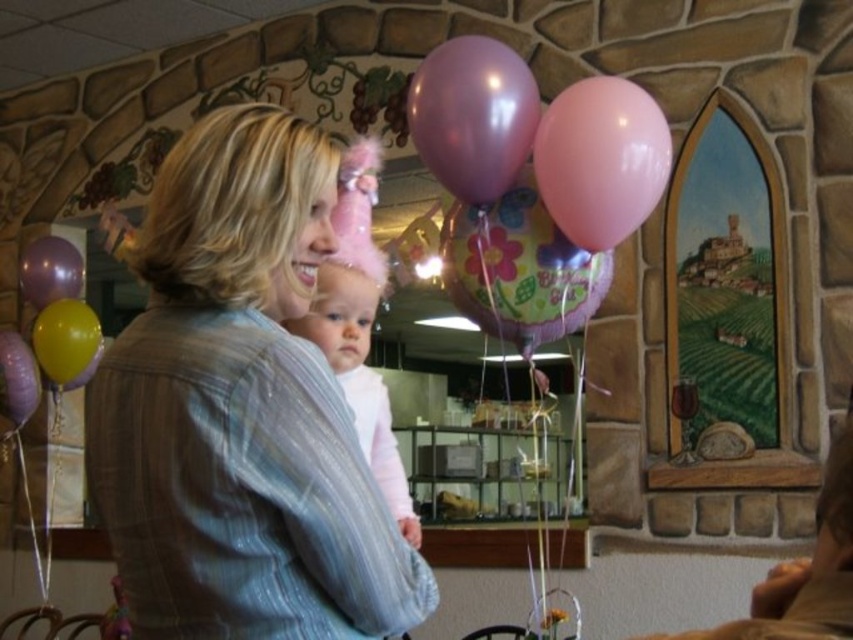
You are a photographer standing in front of the scene. You want to take a photo of the baby and the woman holding it. To ensure the yellow rubber balloon at left does not appear in the photo, where should you position yourself relative to the current viewpoint?

To avoid capturing the yellow rubber balloon at left in the photo, you should position yourself to the right side of the current viewpoint since the balloon is located at the left position at point (65, 339).

You are at a party and want to give a gift wrapped in a box to the baby. The gift is placed on the matte gray jacket at center. To reach the gift, should you move to the left or right of the yellow rubber balloon at left?

Since the matte gray jacket at center is to the right of the yellow rubber balloon at left, you should move to the right of the yellow rubber balloon at left to reach the gift on the matte gray jacket at center.

You are a party planner organizing the balloon arrangement. You need to decide which balloon to place in a narrow vase. Which balloon between the purple glossy balloon at center and the matte yellow balloon at left is more likely to fit in the vase?

The matte yellow balloon at left is more likely to fit in the vase since the purple glossy balloon at center might be wider than the matte yellow balloon at left.